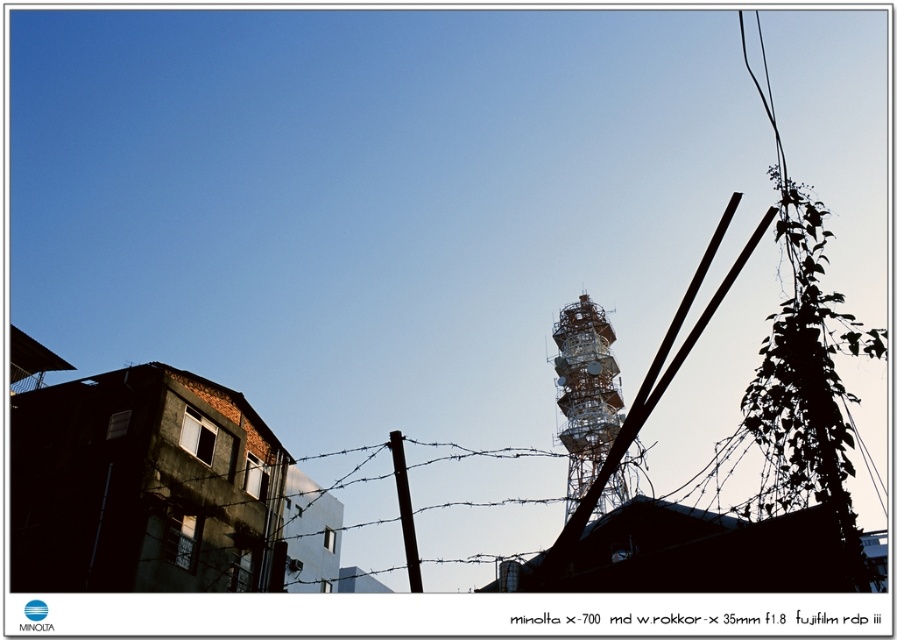
Question: Is metallic lattice tower at center to the right of black matte telegraph pole at center from the viewer's perspective?

Choices:
 (A) yes
 (B) no

Answer: (A)

Question: Which of the following is the farthest from the observer?

Choices:
 (A) (569, 468)
 (B) (414, 556)

Answer: (A)

Question: Which object appears farthest from the camera in this image?

Choices:
 (A) black matte telegraph pole at center
 (B) metallic lattice tower at center

Answer: (B)

Question: Is metallic lattice tower at center smaller than black matte telegraph pole at center?

Choices:
 (A) yes
 (B) no

Answer: (B)

Question: Is metallic lattice tower at center positioned behind black matte telegraph pole at center?

Choices:
 (A) yes
 (B) no

Answer: (A)